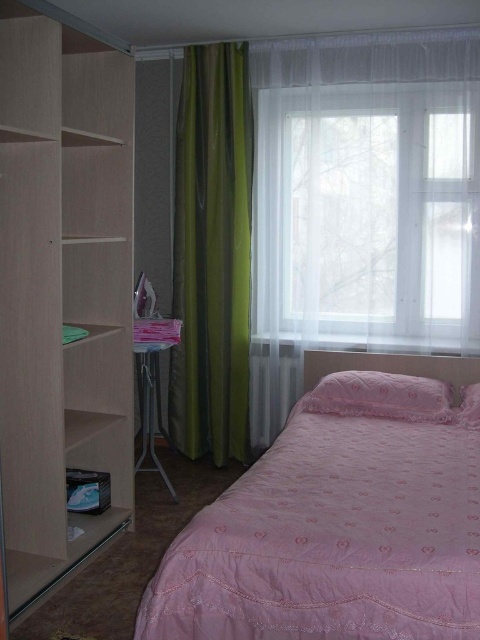
Question: Which of the following is the farthest from the observer?

Choices:
 (A) pink quilted bed at lower right
 (B) pink satin pillow at right
 (C) pink satin pillow at center

Answer: (C)

Question: Does pink quilted bed at lower right have a greater width compared to light wood/transparent shelves at left?

Choices:
 (A) yes
 (B) no

Answer: (A)

Question: Can you confirm if green sheer curtain at center is smaller than pink satin pillow at right?

Choices:
 (A) yes
 (B) no

Answer: (B)

Question: Does green sheer curtain at center appear over pink quilted bed at lower right?

Choices:
 (A) no
 (B) yes

Answer: (B)

Question: Among these objects, which one is nearest to the camera?

Choices:
 (A) pink quilted bed at lower right
 (B) pink satin pillow at center
 (C) pink satin pillow at right

Answer: (A)

Question: Which object is farther from the camera taking this photo?

Choices:
 (A) pink satin pillow at right
 (B) light wood/transparent shelves at left

Answer: (A)